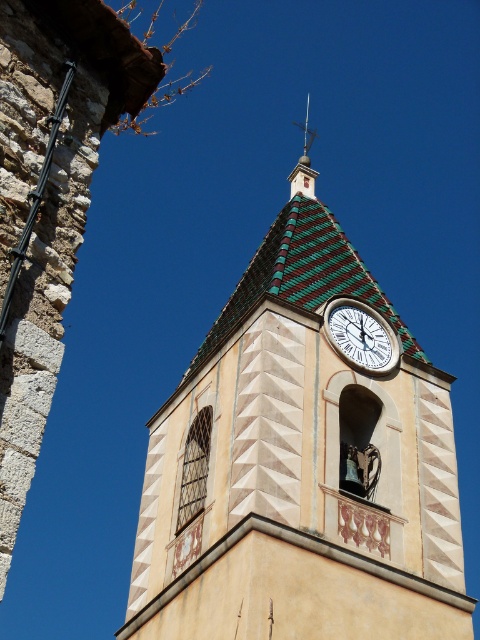
Does point (357, 346) come closer to viewer compared to point (302, 186)?

Yes, point (357, 346) is closer to viewer.

Does white glossy clock at upper center have a smaller size compared to green striped spire at upper center?

Yes.

Is point (374, 317) closer to viewer compared to point (307, 128)?

Yes, point (374, 317) is in front of point (307, 128).

The height and width of the screenshot is (640, 480). Identify the location of white glossy clock at upper center. (360, 336).

From the picture: Which is more to the right, green and white tiled clock tower at center or white glossy clock at upper center?

white glossy clock at upper center is more to the right.

Is the position of green and white tiled clock tower at center less distant than that of white glossy clock at upper center?

Yes, it is.

Between point (284, 484) and point (335, 321), which one is positioned behind?

The point (335, 321) is more distant.

This screenshot has width=480, height=640. In order to click on green and white tiled clock tower at center in this screenshot , I will do `click(300, 468)`.

Measure the distance from green and white tiled clock tower at center to green striped spire at upper center.

green and white tiled clock tower at center is 27.34 meters from green striped spire at upper center.

Which of these two, green and white tiled clock tower at center or green striped spire at upper center, stands taller?

Standing taller between the two is green striped spire at upper center.

Find the location of a particular element. green and white tiled clock tower at center is located at coordinates (300, 468).

This screenshot has height=640, width=480. I want to click on green and white tiled clock tower at center, so click(300, 468).